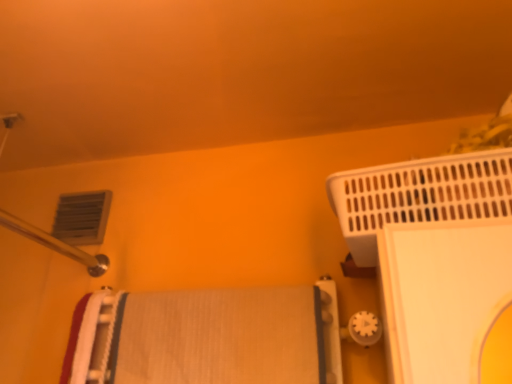
Question: Considering the relative sizes of matte plastic air conditioning at upper left and white textured bath towel at center in the image provided, is matte plastic air conditioning at upper left taller than white textured bath towel at center?

Choices:
 (A) yes
 (B) no

Answer: (B)

Question: Could you tell me if matte plastic air conditioning at upper left is turned towards white textured bath towel at center?

Choices:
 (A) no
 (B) yes

Answer: (A)

Question: Considering the relative sizes of matte plastic air conditioning at upper left and white textured bath towel at center in the image provided, is matte plastic air conditioning at upper left thinner than white textured bath towel at center?

Choices:
 (A) yes
 (B) no

Answer: (A)

Question: Does matte plastic air conditioning at upper left appear on the left side of white textured bath towel at center?

Choices:
 (A) no
 (B) yes

Answer: (B)

Question: Is there a large distance between matte plastic air conditioning at upper left and white textured bath towel at center?

Choices:
 (A) yes
 (B) no

Answer: (B)

Question: Does matte plastic air conditioning at upper left have a greater width compared to white textured bath towel at center?

Choices:
 (A) no
 (B) yes

Answer: (A)

Question: Would you consider white plastic bath heater at upper right to be distant from matte plastic air conditioning at upper left?

Choices:
 (A) yes
 (B) no

Answer: (B)

Question: Does white plastic bath heater at upper right contain matte plastic air conditioning at upper left?

Choices:
 (A) no
 (B) yes

Answer: (A)

Question: Does white plastic bath heater at upper right have a larger size compared to matte plastic air conditioning at upper left?

Choices:
 (A) no
 (B) yes

Answer: (B)

Question: Does white plastic bath heater at upper right have a lesser height compared to matte plastic air conditioning at upper left?

Choices:
 (A) yes
 (B) no

Answer: (B)

Question: Does white plastic bath heater at upper right have a greater width compared to matte plastic air conditioning at upper left?

Choices:
 (A) yes
 (B) no

Answer: (A)

Question: Is white plastic bath heater at upper right taller than matte plastic air conditioning at upper left?

Choices:
 (A) yes
 (B) no

Answer: (A)

Question: Considering the relative sizes of white textured bath towel at center and white plastic bath heater at upper right in the image provided, is white textured bath towel at center wider than white plastic bath heater at upper right?

Choices:
 (A) no
 (B) yes

Answer: (A)